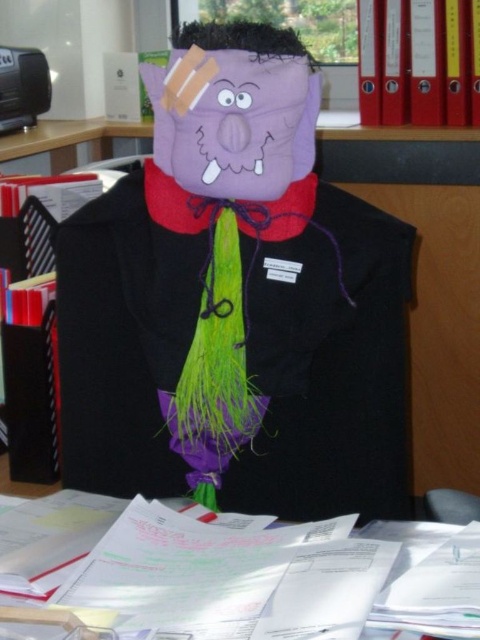
Between white paper at lower center and purple felt mask at center, which one is positioned higher?

purple felt mask at center

Does white paper at lower center have a larger size compared to purple felt mask at center?

Correct, white paper at lower center is larger in size than purple felt mask at center.

Where is `white paper at lower center`? The width and height of the screenshot is (480, 640). white paper at lower center is located at coordinates (265, 580).

You are a GUI agent. You are given a task and a screenshot of the screen. Output one action in this format:
    pyautogui.click(x=<x>, y=<y>)
    Task: Click on the white paper at lower center
    
    Given the screenshot: What is the action you would take?
    pyautogui.click(x=265, y=580)

Can you confirm if matte purple mask at center is positioned below white paper at lower center?

No.

Who is more forward, (121, 394) or (230, 632)?

Point (230, 632)

Between point (156, 456) and point (97, 560), which one is positioned behind?

Point (156, 456)

I want to click on matte purple mask at center, so click(237, 301).

Which is more to the left, matte purple mask at center or purple felt mask at center?

Positioned to the left is matte purple mask at center.

Looking at this image, is matte purple mask at center to the right of purple felt mask at center from the viewer's perspective?

Incorrect, matte purple mask at center is not on the right side of purple felt mask at center.

At what (x,y) coordinates should I click in order to perform the action: click on matte purple mask at center. Please return your answer as a coordinate pair (x, y). This screenshot has height=640, width=480. Looking at the image, I should click on (237, 301).

This screenshot has height=640, width=480. Find the location of `matte purple mask at center`. matte purple mask at center is located at coordinates (237, 301).